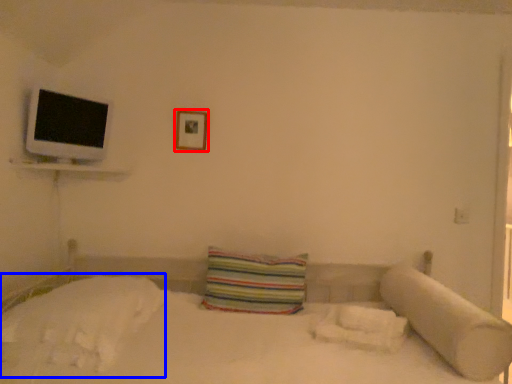
Question: Which object is closer to the camera taking this photo, picture frame (highlighted by a red box) or sheet (highlighted by a blue box)?

Choices:
 (A) picture frame
 (B) sheet

Answer: (B)